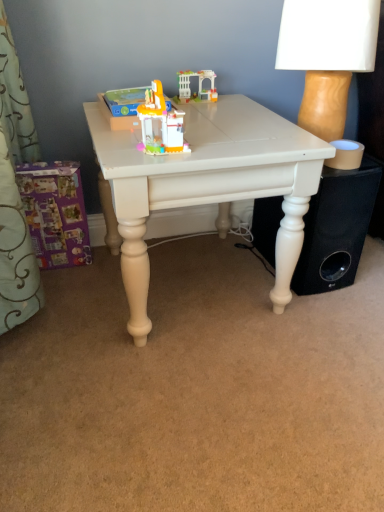
I want to click on vacant area located to the right-hand side of white plastic arch at center, acting as the first toy starting from the top, so click(224, 99).